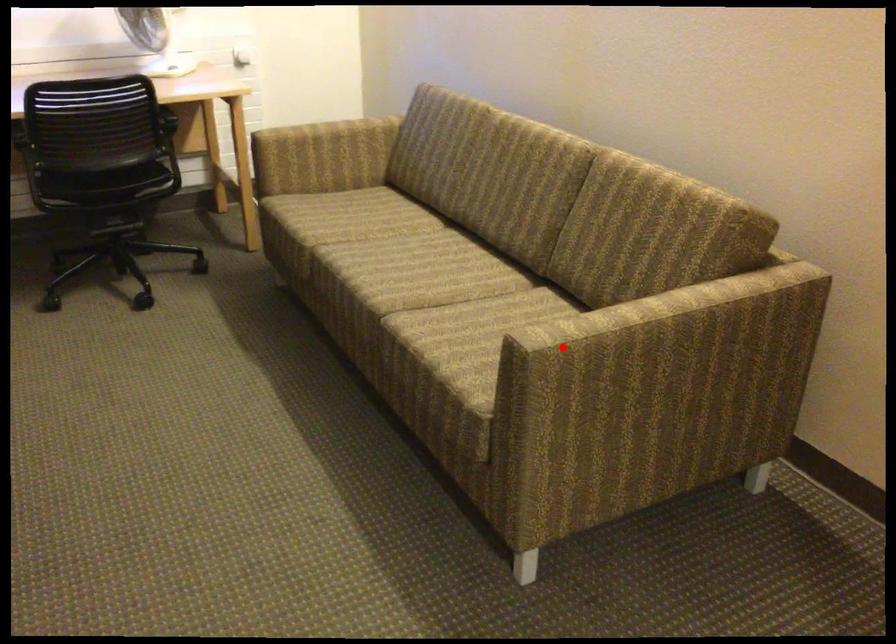
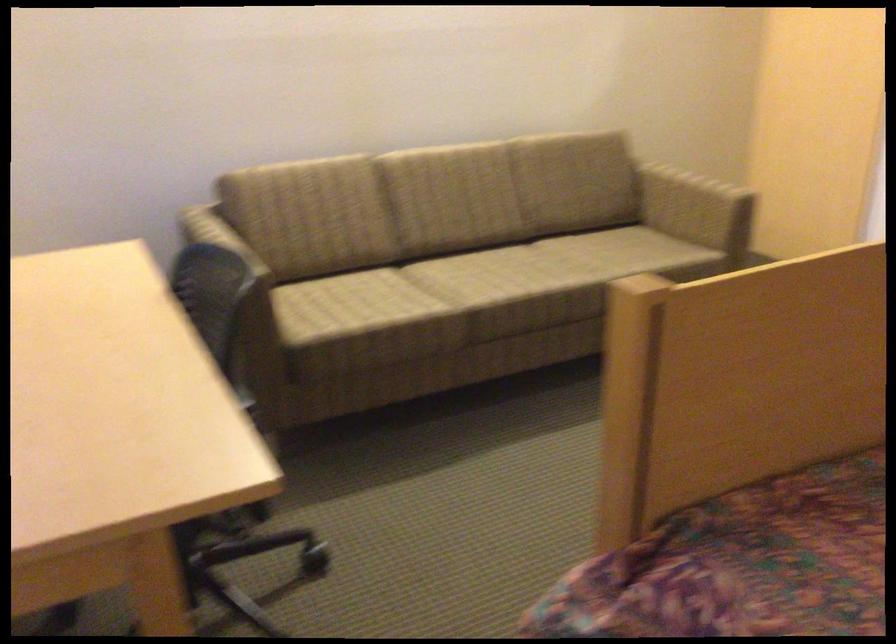
Question: I am providing you with two images of the same scene from different viewpoints. In image1, a red point is highlighted. Considering the same 3D point in image2, which of the following is correct?

Choices:
 (A) It is closer
 (B) It is farther

Answer: (B)